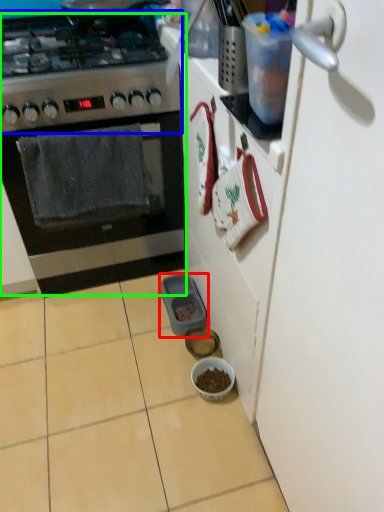
Question: Which is nearer to the appliance (highlighted by a red box)? gas stove (highlighted by a blue box) or kitchen appliance (highlighted by a green box).

Choices:
 (A) gas stove
 (B) kitchen appliance

Answer: (B)